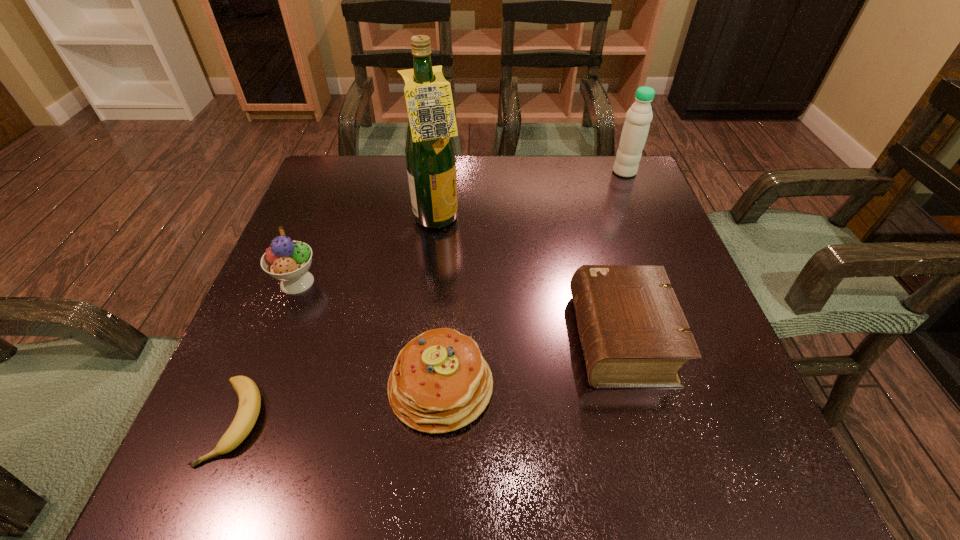
What are the coordinates of `the tallest object` in the screenshot? It's located at (430, 152).

Where is `liquor`? The width and height of the screenshot is (960, 540). liquor is located at coordinates (430, 152).

Locate an element on the screen. This screenshot has height=540, width=960. water bottle is located at coordinates (639, 116).

Where is `the farthest object`? This screenshot has height=540, width=960. the farthest object is located at coordinates (639, 116).

Locate an element on the screen. The height and width of the screenshot is (540, 960). the fourth shortest object is located at coordinates (288, 261).

Where is `the second object from right to left`? the second object from right to left is located at coordinates (634, 334).

Find the location of `pancake`. pancake is located at coordinates (440, 382).

Where is `the shortest object`? the shortest object is located at coordinates pyautogui.click(x=249, y=395).

Locate an element on the screen. The height and width of the screenshot is (540, 960). free space located 0.060m on the front-facing side of the second farthest object is located at coordinates (487, 221).

Identify the location of vacant space situated on the left of the second tallest object. (591, 172).